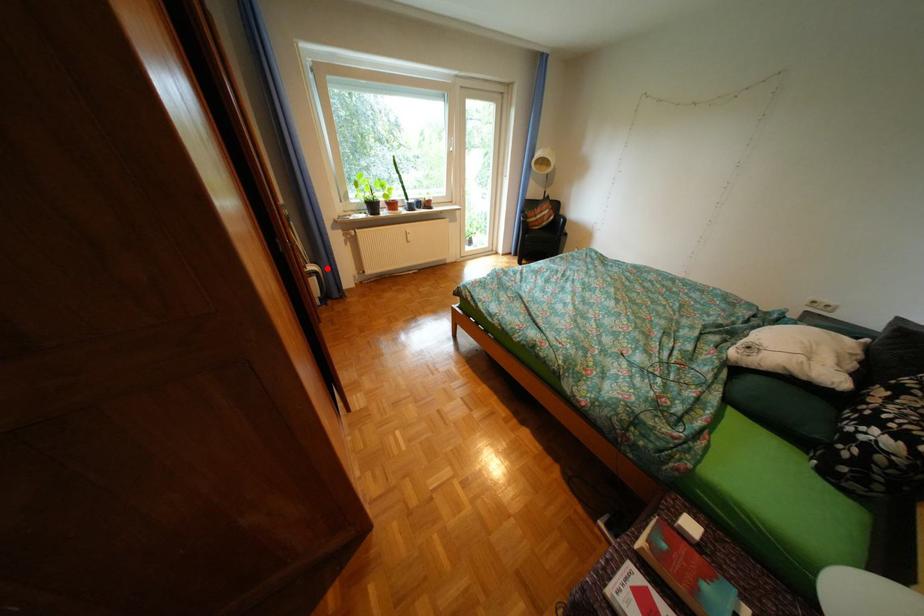
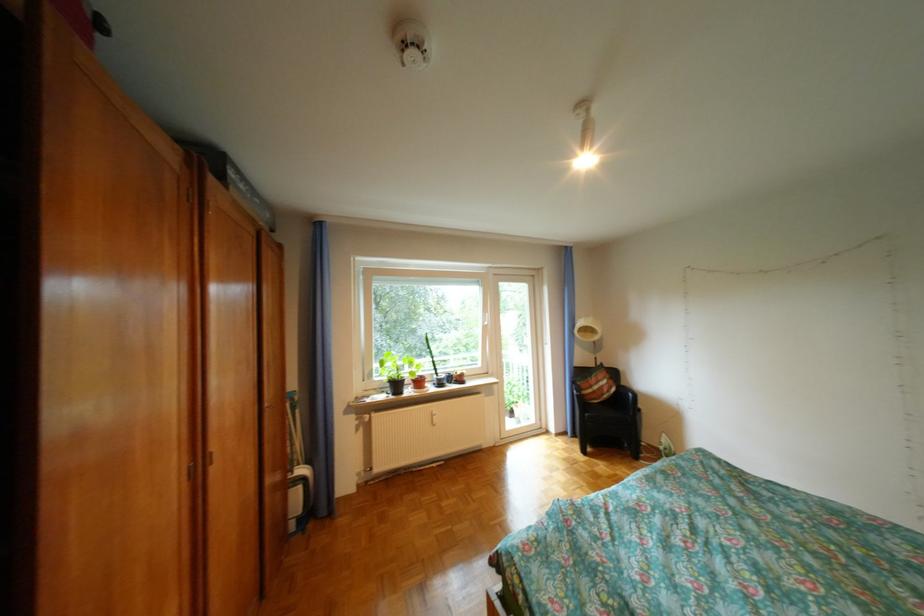
Question: A red point is marked in image1. In image2, is the corresponding 3D point closer to the camera or farther? Reply with the corresponding letter.

Choices:
 (A) The corresponding 3D point is closer.
 (B) The corresponding 3D point is farther.

Answer: (B)